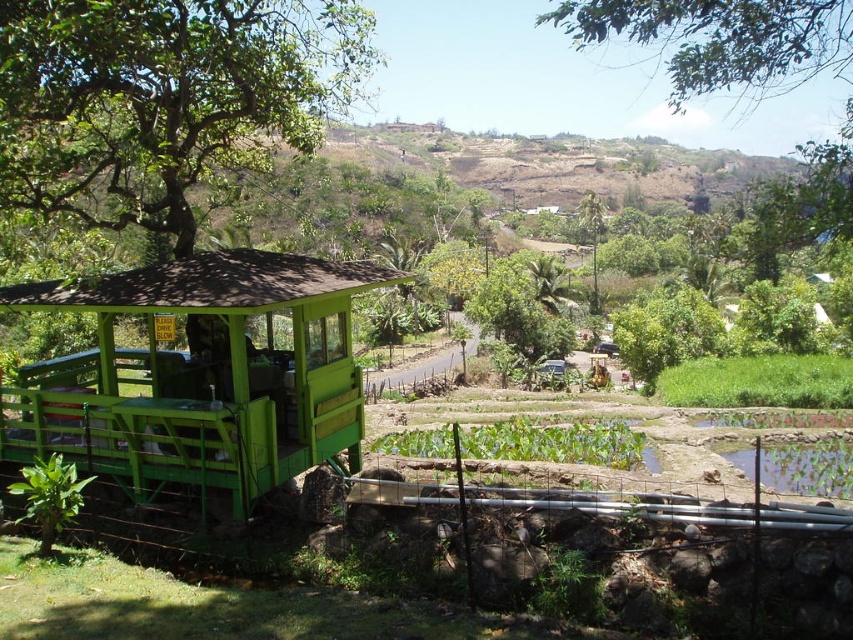
Which is above, green leafy tree at upper left or green leafy tree at upper center?

green leafy tree at upper center

Identify the location of green leafy tree at upper left. (164, 99).

Find the location of a particular element. The width and height of the screenshot is (853, 640). green leafy tree at upper left is located at coordinates (164, 99).

Is green leafy tree at upper left closer to camera compared to green matte gazebo at center?

No.

Is green leafy tree at upper left to the left of green matte gazebo at center from the viewer's perspective?

Correct, you'll find green leafy tree at upper left to the left of green matte gazebo at center.

The image size is (853, 640). I want to click on green leafy tree at upper left, so click(164, 99).

Is green matte gazebo at center closer to camera compared to green leafy tree at upper center?

That is True.

Who is taller, green matte gazebo at center or green leafy tree at upper center?

green leafy tree at upper center is taller.

Between point (251, 307) and point (798, 32), which one is positioned behind?

The point (798, 32) is more distant.

At what (x,y) coordinates should I click in order to perform the action: click on green matte gazebo at center. Please return your answer as a coordinate pair (x, y). The height and width of the screenshot is (640, 853). Looking at the image, I should click on (200, 372).